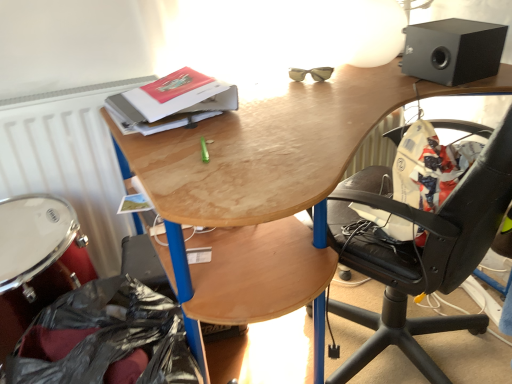
What do you see at coordinates (168, 95) in the screenshot? I see `hardcover book at upper center` at bounding box center [168, 95].

Image resolution: width=512 pixels, height=384 pixels. Describe the element at coordinates (69, 160) in the screenshot. I see `white matte radiator at left` at that location.

Identify the location of black matte speaker at upper right. The height and width of the screenshot is (384, 512). (453, 50).

What's the angular difference between white matte radiator at left and wooden desk at upper center's facing directions?

They differ by 2.38 degrees in their facing directions.

Is point (62, 194) more distant than point (167, 272)?

Yes, point (62, 194) is behind point (167, 272).

How much distance is there between white matte radiator at left and wooden desk at upper center?

They are 21.06 inches apart.

From a real-world perspective, is white matte radiator at left physically located above or below wooden desk at upper center?

In terms of real-world spatial position, white matte radiator at left is above wooden desk at upper center.

Is white matte radiator at left not inside black plastic bag at lower left?

Yes, white matte radiator at left is located beyond the bounds of black plastic bag at lower left.

Based on the photo, considering the sizes of objects white matte radiator at left and black plastic bag at lower left in the image provided, who is thinner, white matte radiator at left or black plastic bag at lower left?

Thinner between the two is white matte radiator at left.

From the image's perspective, is white matte radiator at left positioned above or below black plastic bag at lower left?

From the image's perspective, white matte radiator at left appears above black plastic bag at lower left.

Is white matte radiator at left aimed at black plastic bag at lower left?

Yes.

From the picture: Is there a large distance between hardcover book at upper center and black plastic bag at lower left?

That's not correct — hardcover book at upper center is a little close to black plastic bag at lower left.

Is hardcover book at upper center spatially inside black plastic bag at lower left, or outside of it?

hardcover book at upper center is outside black plastic bag at lower left.

What's the angular difference between hardcover book at upper center and black plastic bag at lower left's facing directions?

They differ by 0.00111 degrees in their facing directions.

Is hardcover book at upper center oriented towards black plastic bag at lower left?

No, hardcover book at upper center does not turn towards black plastic bag at lower left.

Considering the relative sizes of black plastic bag at lower left and white polished drum at lower left in the image provided, is black plastic bag at lower left thinner than white polished drum at lower left?

Yes, black plastic bag at lower left is thinner than white polished drum at lower left.

I want to click on garbage below the white polished drum at lower left (from the image's perspective), so click(x=105, y=339).

Which object is more forward, black plastic bag at lower left or white polished drum at lower left?

Positioned in front is black plastic bag at lower left.

Who is shorter, black plastic bag at lower left or white polished drum at lower left?

With less height is white polished drum at lower left.

Which is less distant, (66,261) or (196,78)?

Point (66,261)

How many degrees apart are the facing directions of white polished drum at lower left and hardcover book at upper center?

They differ by 0.00126 degrees in their facing directions.

Can you confirm if white polished drum at lower left is positioned to the left of hardcover book at upper center?

Yes, white polished drum at lower left is to the left of hardcover book at upper center.

Is there a large distance between white polished drum at lower left and hardcover book at upper center?

No, white polished drum at lower left is in close proximity to hardcover book at upper center.

Are black plastic bag at lower left and black matte speaker at upper right making contact?

No, black plastic bag at lower left is not with black matte speaker at upper right.

Is black plastic bag at lower left positioned in front of black matte speaker at upper right?

Yes, the depth of black plastic bag at lower left is less than that of black matte speaker at upper right.

Can you tell me how much black plastic bag at lower left and black matte speaker at upper right differ in facing direction?

black plastic bag at lower left and black matte speaker at upper right are facing 91.2 degrees away from each other.

Which object is wider, hardcover book at upper center or white matte radiator at left?

With larger width is hardcover book at upper center.

Looking at this image, measure the distance between hardcover book at upper center and white matte radiator at left.

They are 12.72 inches apart.

From a real-world perspective, who is located higher, hardcover book at upper center or white matte radiator at left?

In real-world perspective, hardcover book at upper center is above.

Considering the points (181, 94) and (28, 177), which point is in front, point (181, 94) or point (28, 177)?

The point (181, 94) is more forward.

The width and height of the screenshot is (512, 384). Identify the location of radiator lying above the wooden desk at upper center (from the image's perspective). (69, 160).

Where is `radiator behind the black plastic bag at lower left`? Image resolution: width=512 pixels, height=384 pixels. radiator behind the black plastic bag at lower left is located at coordinates (69, 160).

Which object lies nearer to the anchor point wooden desk at upper center, white polished drum at lower left or hardcover book at upper center?

hardcover book at upper center is closer to wooden desk at upper center.

Looking at the image, which one is located closer to black matte speaker at upper right, black plastic bag at lower left or hardcover book at upper center?

hardcover book at upper center is positioned closer to the anchor black matte speaker at upper right.

Looking at the image, which one is located further to white matte radiator at left, white polished drum at lower left or black matte speaker at upper right?

black matte speaker at upper right.

Which object lies nearer to the anchor point hardcover book at upper center, wooden desk at upper center or white matte radiator at left?

Based on the image, wooden desk at upper center appears to be nearer to hardcover book at upper center.

Looking at the image, which one is located further to black plastic bag at lower left, white matte radiator at left or black matte speaker at upper right?

black matte speaker at upper right lies further to black plastic bag at lower left than the other object.

In the scene shown: Looking at the image, which one is located further to hardcover book at upper center, white polished drum at lower left or black plastic bag at lower left?

Based on the image, black plastic bag at lower left appears to be further to hardcover book at upper center.

Which object lies nearer to the anchor point white matte radiator at left, black plastic bag at lower left or white polished drum at lower left?

The object closer to white matte radiator at left is white polished drum at lower left.

Based on their spatial positions, is white matte radiator at left or black matte speaker at upper right closer to wooden desk at upper center?

Based on the image, black matte speaker at upper right appears to be nearer to wooden desk at upper center.

Identify the location of desk that lies between hardcover book at upper center and black plastic bag at lower left from top to bottom. (266, 148).

Image resolution: width=512 pixels, height=384 pixels. I want to click on radiator between white polished drum at lower left and wooden desk at upper center in the horizontal direction, so click(69, 160).

Where is `drum that lies between white matte radiator at left and black plastic bag at lower left from top to bottom`? The image size is (512, 384). drum that lies between white matte radiator at left and black plastic bag at lower left from top to bottom is located at coordinates (37, 260).

At what (x,y) coordinates should I click in order to perform the action: click on paperback book located between white polished drum at lower left and black matte speaker at upper right in the left-right direction. Please return your answer as a coordinate pair (x, y). The width and height of the screenshot is (512, 384). Looking at the image, I should click on (168, 95).